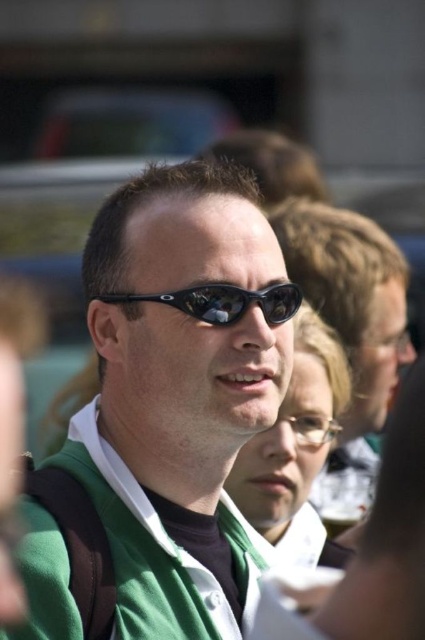
Who is shorter, black plastic sunglasses at center or clear glass beer at center?

clear glass beer at center is shorter.

Can you confirm if black plastic sunglasses at center is thinner than clear glass beer at center?

In fact, black plastic sunglasses at center might be wider than clear glass beer at center.

Does point (215, 289) lie in front of point (340, 528)?

Yes, point (215, 289) is in front of point (340, 528).

Where is `black plastic sunglasses at center`? black plastic sunglasses at center is located at coordinates (221, 301).

Is matte black sunglasses at center behind black plastic sunglasses at center?

Yes, matte black sunglasses at center is behind black plastic sunglasses at center.

Which is in front, point (359, 428) or point (243, 307)?

Positioned in front is point (243, 307).

Is point (356, 250) farther from viewer compared to point (291, 285)?

Yes, it is behind point (291, 285).

Where is `matte black sunglasses at center`? This screenshot has width=425, height=640. matte black sunglasses at center is located at coordinates [x=351, y=324].

Who is positioned more to the left, matte black sunglasses at center or clear glass beer at center?

clear glass beer at center is more to the left.

Describe the element at coordinates (351, 324) in the screenshot. I see `matte black sunglasses at center` at that location.

The width and height of the screenshot is (425, 640). I want to click on matte black sunglasses at center, so click(x=351, y=324).